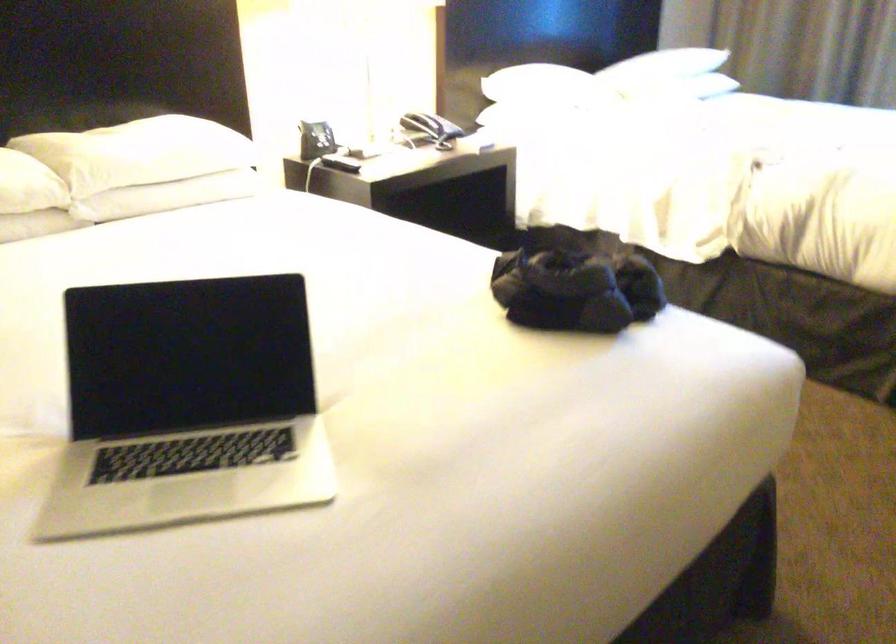
Where is `telephone handset`? The width and height of the screenshot is (896, 644). telephone handset is located at coordinates tap(436, 135).